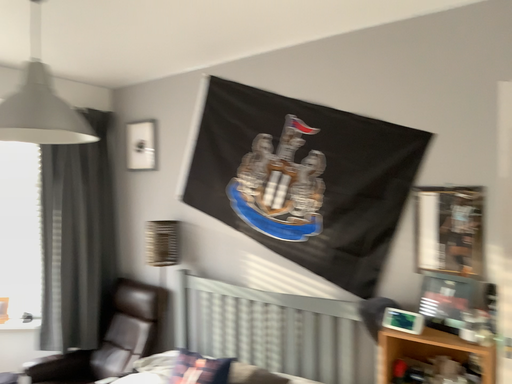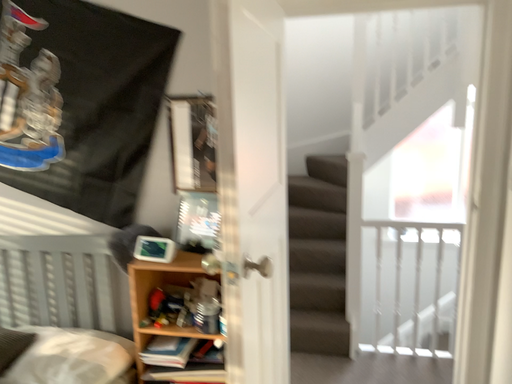
Question: Which way did the camera rotate in the video?

Choices:
 (A) rotated downward
 (B) rotated upward

Answer: (A)